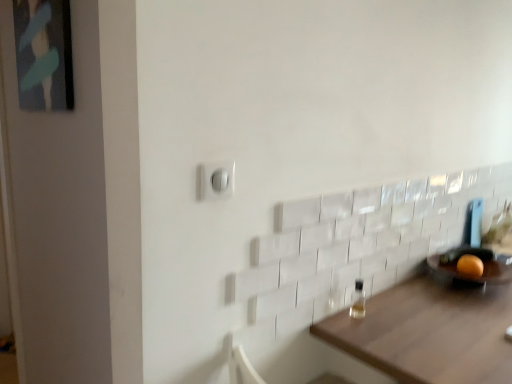
Question: Can you confirm if white plastic light switch at center is positioned to the right of transparent glass bottle at lower right?

Choices:
 (A) no
 (B) yes

Answer: (A)

Question: Does white plastic light switch at center have a lesser height compared to transparent glass bottle at lower right?

Choices:
 (A) no
 (B) yes

Answer: (B)

Question: Is white plastic light switch at center not inside transparent glass bottle at lower right?

Choices:
 (A) yes
 (B) no

Answer: (A)

Question: Does white plastic light switch at center contain transparent glass bottle at lower right?

Choices:
 (A) no
 (B) yes

Answer: (A)

Question: Does white plastic light switch at center have a lesser width compared to transparent glass bottle at lower right?

Choices:
 (A) yes
 (B) no

Answer: (A)

Question: Is white plastic light switch at center bigger than transparent glass bottle at lower right?

Choices:
 (A) yes
 (B) no

Answer: (B)

Question: Is matte black picture frame at upper left to the left of orange matte at right from the viewer's perspective?

Choices:
 (A) yes
 (B) no

Answer: (A)

Question: From a real-world perspective, is matte black picture frame at upper left below orange matte at right?

Choices:
 (A) no
 (B) yes

Answer: (A)

Question: Does matte black picture frame at upper left have a greater height compared to orange matte at right?

Choices:
 (A) yes
 (B) no

Answer: (A)

Question: Is matte black picture frame at upper left not near orange matte at right?

Choices:
 (A) yes
 (B) no

Answer: (A)

Question: Considering the relative sizes of matte black picture frame at upper left and orange matte at right in the image provided, is matte black picture frame at upper left wider than orange matte at right?

Choices:
 (A) yes
 (B) no

Answer: (B)

Question: Is matte black picture frame at upper left oriented away from orange matte at right?

Choices:
 (A) yes
 (B) no

Answer: (B)

Question: From the image's perspective, is transparent glass bottle at lower right under brown wooden table at lower right?

Choices:
 (A) no
 (B) yes

Answer: (A)